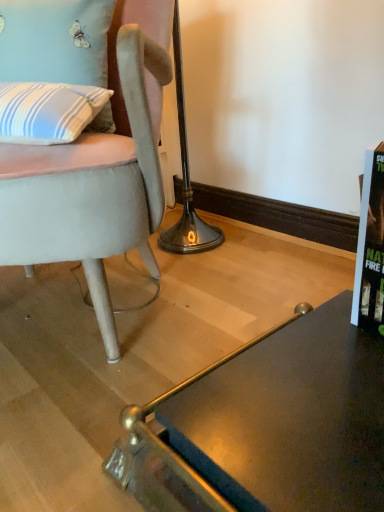
Question: Considering the relative sizes of glassy dark brown desk at lower right and suede-like gray chair at left in the image provided, is glassy dark brown desk at lower right smaller than suede-like gray chair at left?

Choices:
 (A) no
 (B) yes

Answer: (B)

Question: From the image's perspective, would you say glassy dark brown desk at lower right is shown under suede-like gray chair at left?

Choices:
 (A) yes
 (B) no

Answer: (A)

Question: Does glassy dark brown desk at lower right have a greater height compared to suede-like gray chair at left?

Choices:
 (A) yes
 (B) no

Answer: (B)

Question: Is glassy dark brown desk at lower right far away from suede-like gray chair at left?

Choices:
 (A) yes
 (B) no

Answer: (B)

Question: Can you confirm if glassy dark brown desk at lower right is wider than suede-like gray chair at left?

Choices:
 (A) no
 (B) yes

Answer: (B)

Question: Is glassy dark brown desk at lower right oriented away from suede-like gray chair at left?

Choices:
 (A) no
 (B) yes

Answer: (B)

Question: Does suede-like gray chair at left appear on the right side of blue striped fabric pillow at upper left?

Choices:
 (A) yes
 (B) no

Answer: (B)

Question: Could blue striped fabric pillow at upper left be considered to be inside suede-like gray chair at left?

Choices:
 (A) no
 (B) yes

Answer: (B)

Question: Is suede-like gray chair at left turned away from blue striped fabric pillow at upper left?

Choices:
 (A) yes
 (B) no

Answer: (A)

Question: Is suede-like gray chair at left bigger than blue striped fabric pillow at upper left?

Choices:
 (A) no
 (B) yes

Answer: (B)

Question: Can you confirm if suede-like gray chair at left is taller than blue striped fabric pillow at upper left?

Choices:
 (A) yes
 (B) no

Answer: (A)

Question: From a real-world perspective, is suede-like gray chair at left positioned under blue striped fabric pillow at upper left based on gravity?

Choices:
 (A) no
 (B) yes

Answer: (B)

Question: Is suede-like gray chair at left bigger than glassy dark brown desk at lower right?

Choices:
 (A) yes
 (B) no

Answer: (A)